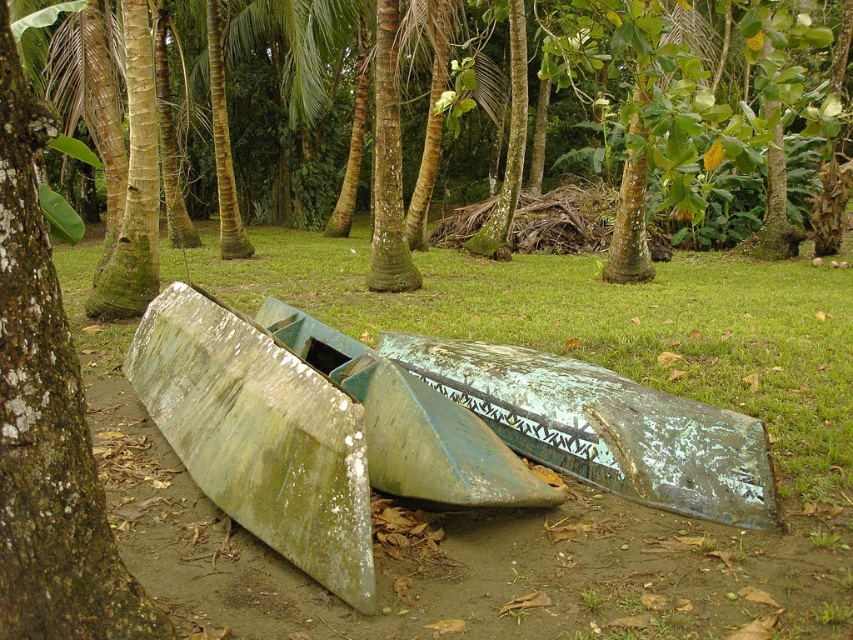
Based on the photo, you are standing in a tropical area with two old boats. You see the green mossy canoe at lower center and the green mossy wood boat at lower left. Which one is positioned to the right side?

The green mossy canoe at lower center is positioned to the right of the green mossy wood boat at lower left.